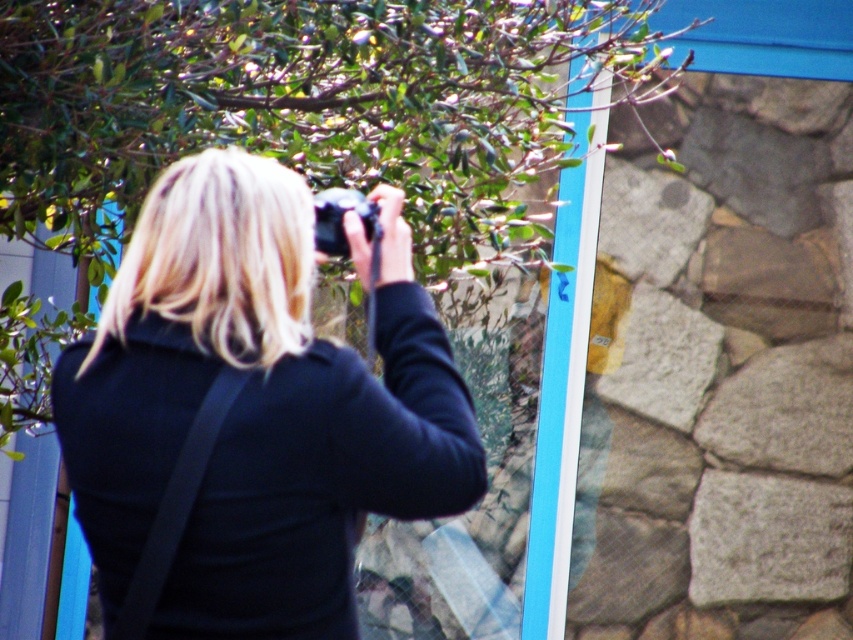
You are a photographer trying to capture a clear shot through the glass. You have two cameras available, the black matte camera at upper center and the black plastic camera at center. Which camera should you use to ensure the clearest image, considering their positions relative to the glass?

The black matte camera at upper center is in front of the black plastic camera at center, so using the black matte camera at upper center would be closer to the glass and provide a clearer image.

You are a photographer who wants to choose between the black matte camera at upper center and the black plastic camera at center based on their sizes. Which camera is wider?

The black matte camera at upper center is wider than the black plastic camera at center.

You are standing in front of the glass window where the person is taking a photo. There are two points marked on the glass at coordinates point (218, 456) and point (346, 200). Which point is nearer to you?

Point (218, 456) is closer to the viewer than point (346, 200).